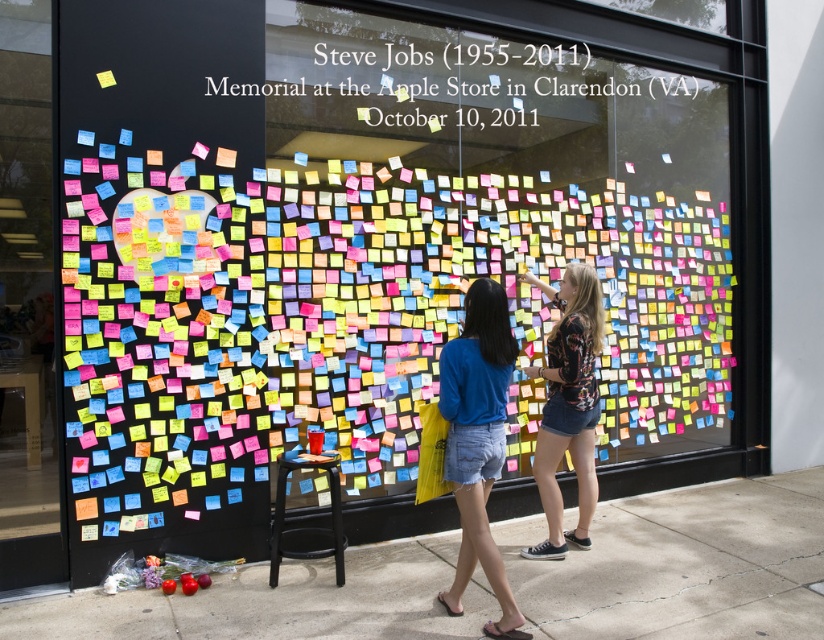
Question: Which object is positioned farthest from the denim shorts at center?

Choices:
 (A) black paper at upper center
 (B) floral print shirt at center

Answer: (A)

Question: Can you confirm if black paper at upper center is smaller than floral print shirt at center?

Choices:
 (A) yes
 (B) no

Answer: (B)

Question: Is black paper at upper center bigger than black matte stool at lower center?

Choices:
 (A) no
 (B) yes

Answer: (B)

Question: Which of the following is the farthest from the observer?

Choices:
 (A) (544, 509)
 (B) (279, 77)

Answer: (B)

Question: Which of the following is the farthest from the observer?

Choices:
 (A) [478, 337]
 (B) [279, 554]

Answer: (B)

Question: Can you confirm if black paper at upper center is positioned to the left of black matte stool at lower center?

Choices:
 (A) yes
 (B) no

Answer: (B)